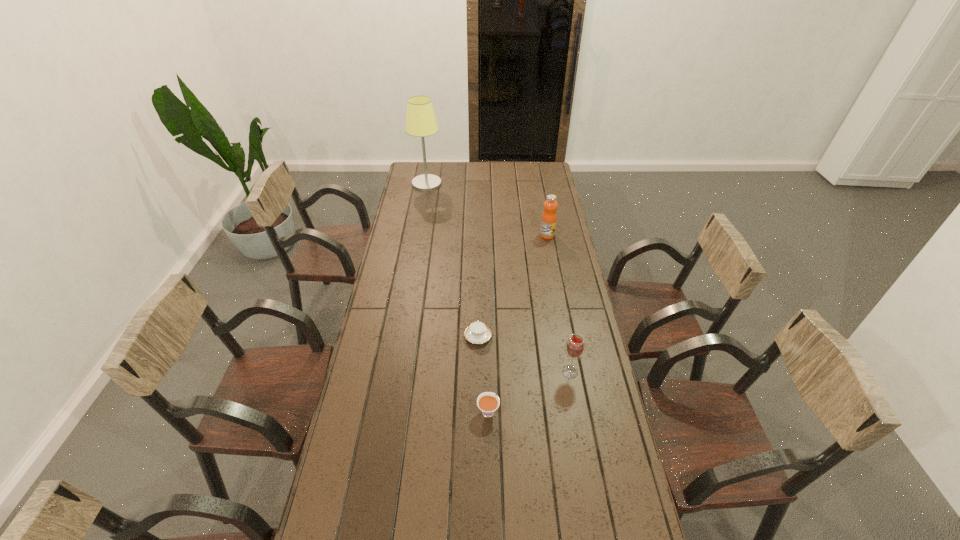
Identify the location of vacant space that's between the taller teacup and the third farthest object. Image resolution: width=960 pixels, height=540 pixels. (483, 374).

Locate an element on the screen. vacant space that is in between the nearest object and the wineglass is located at coordinates (529, 392).

Point out which object is positioned as the fourth nearest to the shorter teacup. Please provide its 2D coordinates. Your answer should be formatted as a tuple, i.e. [(x, y)], where the tuple contains the x and y coordinates of a point satisfying the conditions above.

[(421, 121)]

I want to click on object that is the second nearest to the wineglass, so click(x=477, y=333).

What are the coordinates of `the closest teacup relative to the fruit juice` in the screenshot? It's located at (477, 333).

Where is `vacant area in the image that satisfies the following two spatial constraints: 1. on the front side of the farthest object; 2. on the left side of the second nearest object`? The height and width of the screenshot is (540, 960). vacant area in the image that satisfies the following two spatial constraints: 1. on the front side of the farthest object; 2. on the left side of the second nearest object is located at coordinates (394, 372).

Find the location of a particular element. vacant area that satisfies the following two spatial constraints: 1. on the side of the second farthest object with the handle; 2. on the left side of the fourth tallest object is located at coordinates (486, 235).

Find the location of a particular element. The image size is (960, 540). free space that satisfies the following two spatial constraints: 1. on the front side of the tallest object; 2. on the left side of the fourth farthest object is located at coordinates pyautogui.click(x=394, y=372).